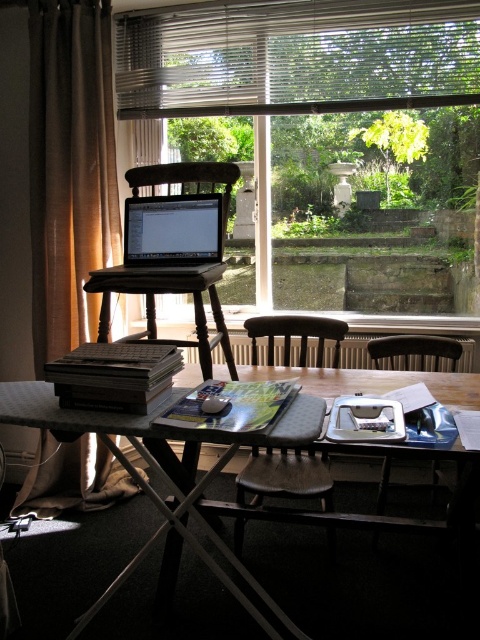
Is point (165, 516) behind point (379, 355)?

That is False.

Can you confirm if wooden table at center is smaller than wooden chair at center?

No, wooden table at center is not smaller than wooden chair at center.

Identify the location of wooden table at center. (111, 451).

Locate an element on the screen. wooden table at center is located at coordinates (111, 451).

Can you confirm if metallic blinds at upper center is positioned to the left of wooden table at center?

No, metallic blinds at upper center is not to the left of wooden table at center.

The width and height of the screenshot is (480, 640). Identify the location of metallic blinds at upper center. (298, 56).

Is point (285, 358) closer to camera compared to point (412, 340)?

No, it is not.

Does dark wood chair at center have a greater height compared to wooden chair at center?

Indeed, dark wood chair at center has a greater height compared to wooden chair at center.

Is point (271, 472) closer to viewer compared to point (436, 368)?

Yes, it is in front of point (436, 368).

The width and height of the screenshot is (480, 640). In order to click on dark wood chair at center in this screenshot , I will do `click(286, 477)`.